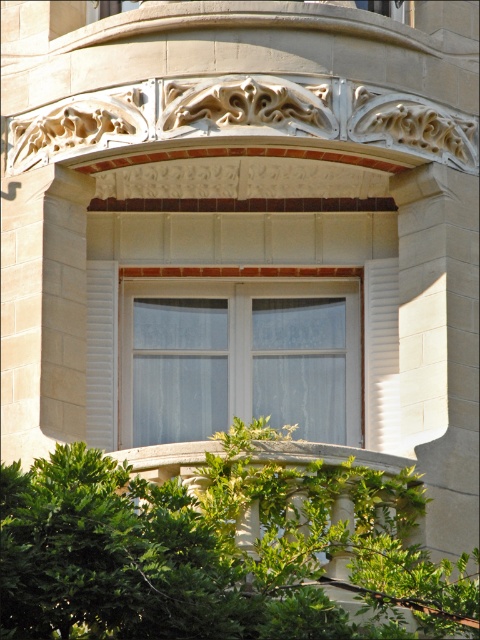
You are standing in front of the building and want to place a small decorative statue exactly at the location where the green leafy bush at lower center is currently positioned. What are the coordinates of the spot where you should place the statue?

The coordinates for the green leafy bush at lower center are at point (214,550), so you should place the statue there.

You are a window cleaner standing at the base of the building. You see the green leafy bush at lower center and the bay window with ornate architectural details. Which object is closer to you?

The green leafy bush at lower center is closer to you since it is at lower center, while the bay window with ornate architectural details is higher up.

Looking at this image, you are a window cleaner with a 1.2 meter wide ladder. You need to clean the green leafy bush at lower center and the white glass window at center. Which object requires a wider ladder to clean its entire width?

The green leafy bush at lower center requires a wider ladder because its width is larger than the white glass window at center.